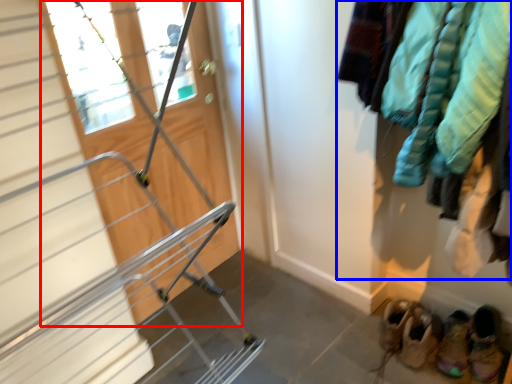
Question: Which object is closer to the camera taking this photo, door (highlighted by a red box) or clothing (highlighted by a blue box)?

Choices:
 (A) door
 (B) clothing

Answer: (A)